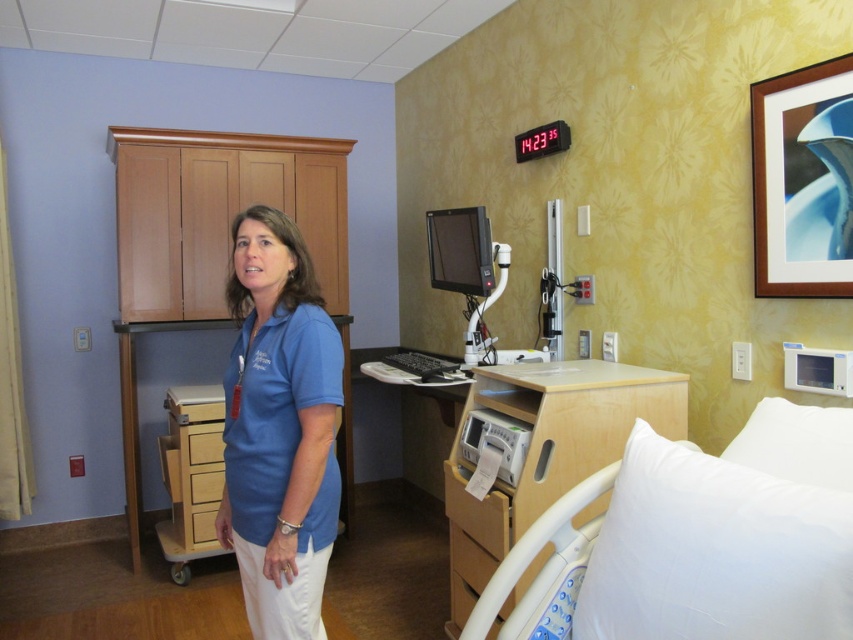
Is point (242, 401) positioned in front of point (766, 502)?

No.

Can you confirm if blue cotton shirt at center is positioned below white soft hospital bed at lower right?

No.

This screenshot has width=853, height=640. I want to click on blue cotton shirt at center, so click(x=279, y=428).

Identify the location of blue cotton shirt at center. (279, 428).